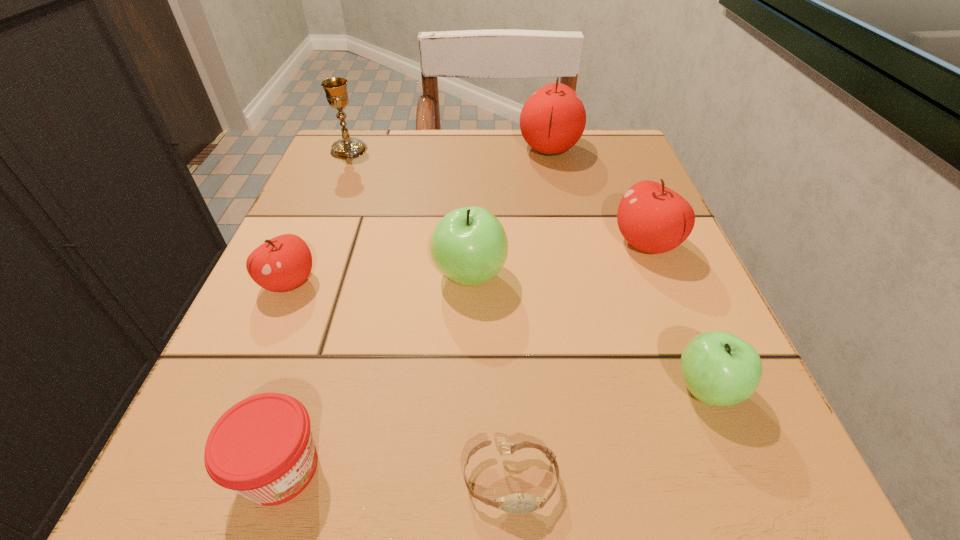
You are a GUI agent. You are given a task and a screenshot of the screen. Output one action in this format:
    pyautogui.click(x=<x>, y=<y>)
    Task: Click on the jam
    
    Given the screenshot: What is the action you would take?
    pyautogui.click(x=262, y=448)

Find the location of a particular element. the shortest object is located at coordinates pos(520,503).

Where is `watch`? watch is located at coordinates (520, 503).

This screenshot has width=960, height=540. I want to click on vacant space located 0.080m on the right of the tallest apple, so click(x=617, y=148).

You are a GUI agent. You are given a task and a screenshot of the screen. Output one action in this format:
    pyautogui.click(x=<x>, y=<y>)
    Task: Click on the blank space located on the front of the chalice
    
    Given the screenshot: What is the action you would take?
    pyautogui.click(x=328, y=201)

Identify the location of free spot located 0.190m on the back of the left green apple. The height and width of the screenshot is (540, 960). (472, 186).

The image size is (960, 540). I want to click on free space located on the front of the rightmost red apple, so click(740, 474).

Find the location of a particular element. free region located on the back of the leftmost apple is located at coordinates (309, 235).

Identify the location of vacant space situated on the back of the right green apple. This screenshot has height=540, width=960. (639, 226).

Image resolution: width=960 pixels, height=540 pixels. In order to click on vacant region located 0.160m on the label side of the jam in this screenshot , I will do `click(473, 468)`.